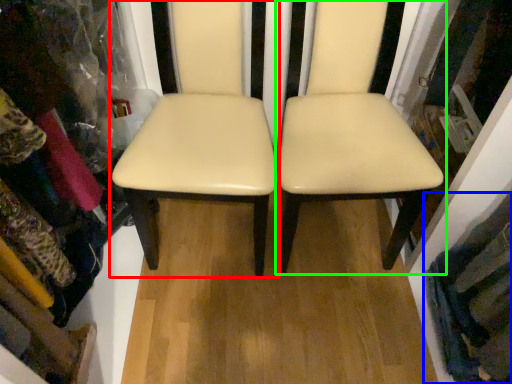
Question: Which object is positioned closest to chair (highlighted by a red box)? Select from clothing (highlighted by a blue box) and chair (highlighted by a green box).

Choices:
 (A) clothing
 (B) chair

Answer: (B)